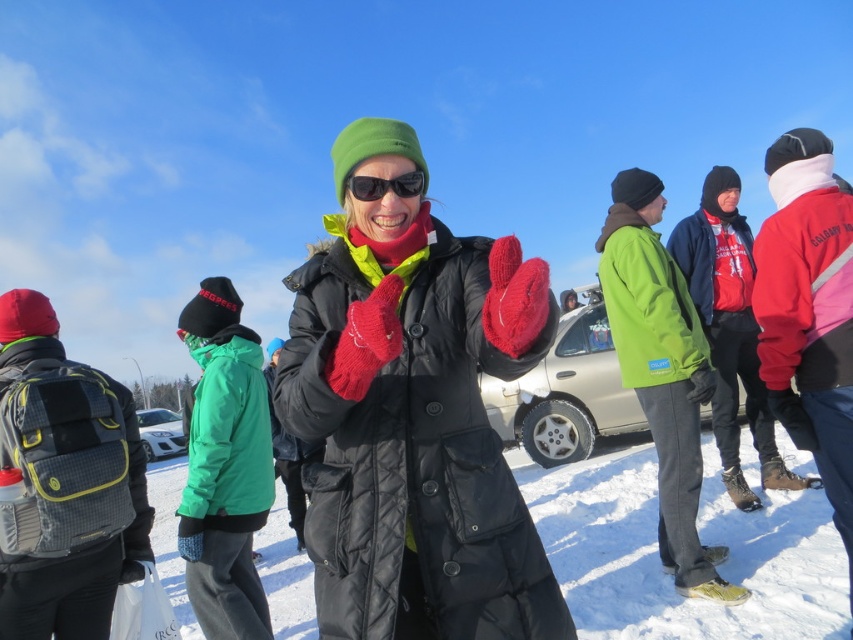
You are a photographer trying to capture a photo of the gray mesh backpack at left and the red fleece jacket at right. Which object should you focus on first if you want to include both in your frame without moving the camera?

The gray mesh backpack at left is to the left of the red fleece jacket at right, so you should focus on the gray mesh backpack at left first to ensure both are in the frame without moving the camera.